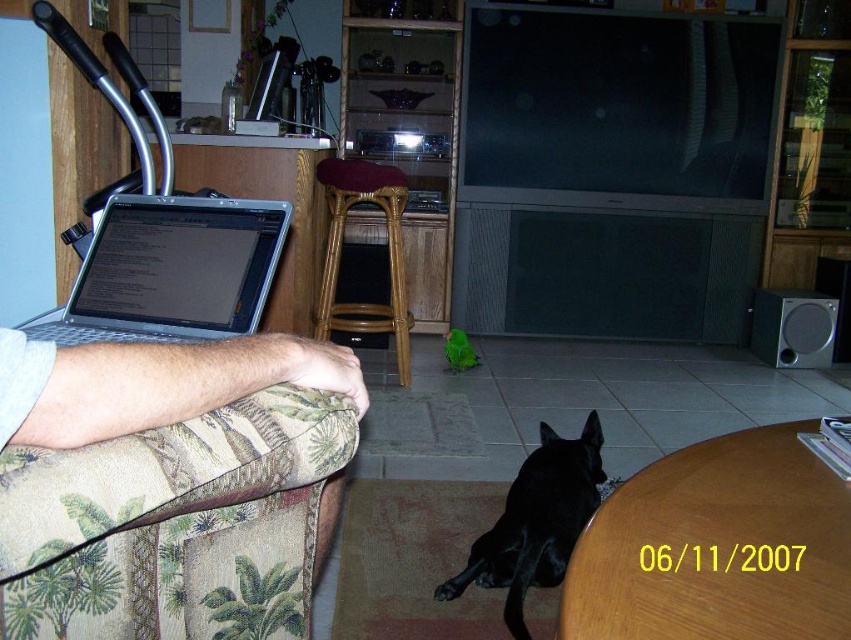
Consider the image. Does light skin toneskinhand at lower left have a lesser width compared to black glossy dog at lower center?

Indeed, light skin toneskinhand at lower left has a lesser width compared to black glossy dog at lower center.

Is light skin toneskinhand at lower left taller than black glossy dog at lower center?

In fact, light skin toneskinhand at lower left may be shorter than black glossy dog at lower center.

Identify the location of light skin toneskinhand at lower left. This screenshot has height=640, width=851. (153, 381).

Can you confirm if silver metallic laptop at upper left is smaller than black glossy dog at lower center?

Indeed, silver metallic laptop at upper left has a smaller size compared to black glossy dog at lower center.

Which is below, silver metallic laptop at upper left or black glossy dog at lower center?

black glossy dog at lower center is below.

Image resolution: width=851 pixels, height=640 pixels. I want to click on silver metallic laptop at upper left, so pos(172,269).

Who is positioned more to the right, brown wooden table at lower right or rattan stool at center?

Positioned to the right is brown wooden table at lower right.

Can you confirm if brown wooden table at lower right is taller than rattan stool at center?

Incorrect, brown wooden table at lower right's height is not larger of rattan stool at center's.

Between point (803, 477) and point (334, 212), which one is positioned in front?

Point (803, 477) is more forward.

The height and width of the screenshot is (640, 851). What are the coordinates of `brown wooden table at lower right` in the screenshot? It's located at (717, 547).